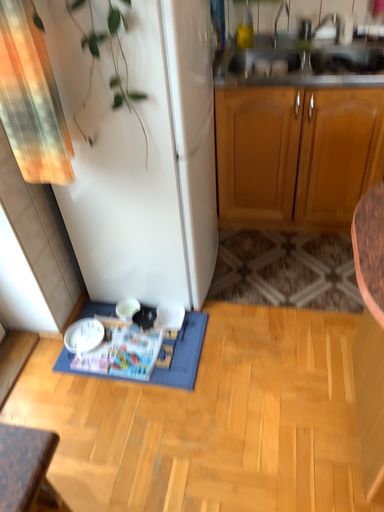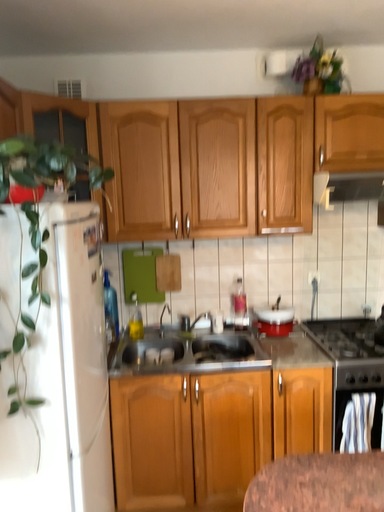
Question: Which way did the camera rotate in the video?

Choices:
 (A) rotated downward
 (B) rotated upward

Answer: (B)